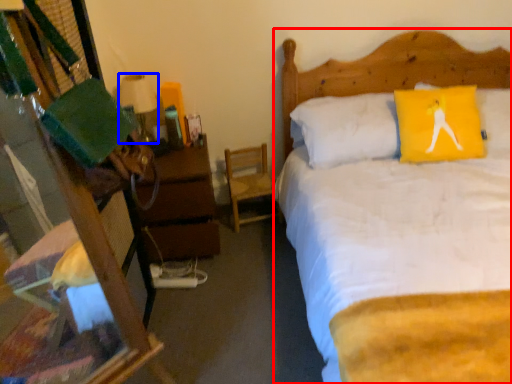
Question: Which of the following is the closest to the observer, bed (highlighted by a red box) or lamp (highlighted by a blue box)?

Choices:
 (A) bed
 (B) lamp

Answer: (A)